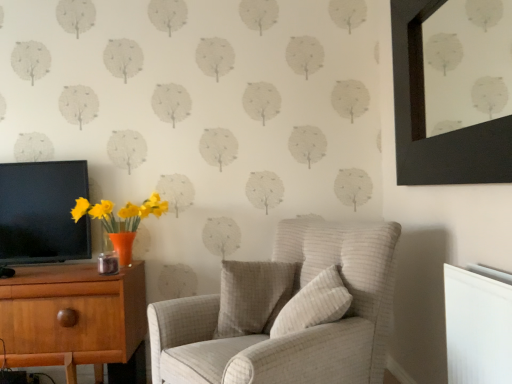
Question: Is black glossy tv at left wider than beige textured pillow at center, marked as the first pillow in a front-to-back arrangement?

Choices:
 (A) yes
 (B) no

Answer: (B)

Question: From the image's perspective, is black glossy tv at left below beige textured pillow at center, acting as the 2th pillow starting from the back?

Choices:
 (A) no
 (B) yes

Answer: (A)

Question: Can you confirm if black glossy tv at left is positioned to the left of beige textured pillow at center, acting as the 2th pillow starting from the back?

Choices:
 (A) yes
 (B) no

Answer: (A)

Question: Are black glossy tv at left and beige textured pillow at center, acting as the 2th pillow starting from the back, beside each other?

Choices:
 (A) yes
 (B) no

Answer: (B)

Question: Is beige textured pillow at center, acting as the 2th pillow starting from the back, completely or partially inside black glossy tv at left?

Choices:
 (A) no
 (B) yes

Answer: (A)

Question: Is black glossy tv at left wider or thinner than light beige fabric armchair at center?

Choices:
 (A) thin
 (B) wide

Answer: (A)

Question: In the image, is black glossy tv at left on the left side or the right side of light beige fabric armchair at center?

Choices:
 (A) left
 (B) right

Answer: (A)

Question: Does point (31, 213) appear closer or farther from the camera than point (267, 326)?

Choices:
 (A) farther
 (B) closer

Answer: (A)

Question: Is black glossy tv at left in front of or behind light beige fabric armchair at center in the image?

Choices:
 (A) front
 (B) behind

Answer: (B)

Question: Looking at the image, does wooden desk at left seem bigger or smaller compared to textured white pillow at center, the 2th pillow positioned from the front?

Choices:
 (A) big
 (B) small

Answer: (A)

Question: Considering their positions, is wooden desk at left located in front of or behind textured white pillow at center, which is counted as the first pillow, starting from the back?

Choices:
 (A) behind
 (B) front

Answer: (A)

Question: From the image's perspective, relative to textured white pillow at center, the 2th pillow positioned from the front, is wooden desk at left above or below?

Choices:
 (A) below
 (B) above

Answer: (A)

Question: Visually, is wooden desk at left positioned to the left or to the right of textured white pillow at center, the 2th pillow positioned from the front?

Choices:
 (A) right
 (B) left

Answer: (B)

Question: Is point (324, 281) closer or farther from the camera than point (145, 332)?

Choices:
 (A) closer
 (B) farther

Answer: (A)

Question: From the image's perspective, relative to wooden desk at left, is beige textured pillow at center, marked as the first pillow in a front-to-back arrangement, above or below?

Choices:
 (A) above
 (B) below

Answer: (A)